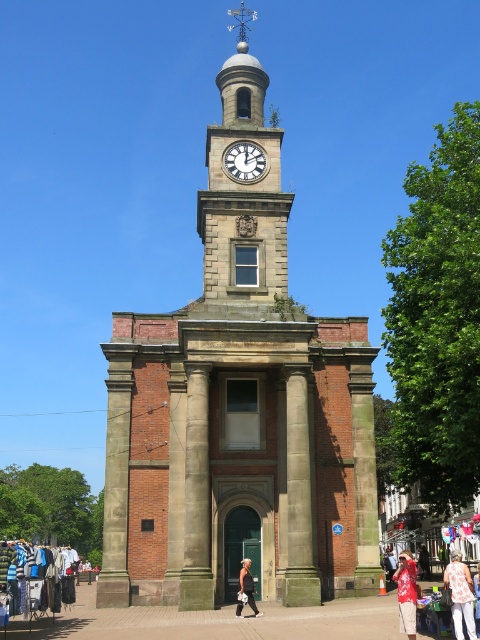
Question: Which object is closer to the camera taking this photo?

Choices:
 (A) white cotton shirt at lower right
 (B) white textured bag at center
 (C) white glossy clock at center

Answer: (A)

Question: In this image, where is brown stone clock tower at center located relative to white glossy clock at center?

Choices:
 (A) below
 (B) above

Answer: (B)

Question: Is brown stone clock tower at center closer to camera compared to white glossy clock at center?

Choices:
 (A) yes
 (B) no

Answer: (A)

Question: Is white glossy clock at center thinner than white cotton shirt at lower right?

Choices:
 (A) yes
 (B) no

Answer: (A)

Question: Which of these objects is positioned farthest from the light pink floral blouse at lower right?

Choices:
 (A) white textured bag at center
 (B) brown stone clock tower at center
 (C) white glossy clock at center

Answer: (C)

Question: Which is farther from the white glossy clock at center?

Choices:
 (A) brown stone clock tower at center
 (B) white cotton shirt at lower right
 (C) white textured bag at center
 (D) light pink floral blouse at lower right

Answer: (D)